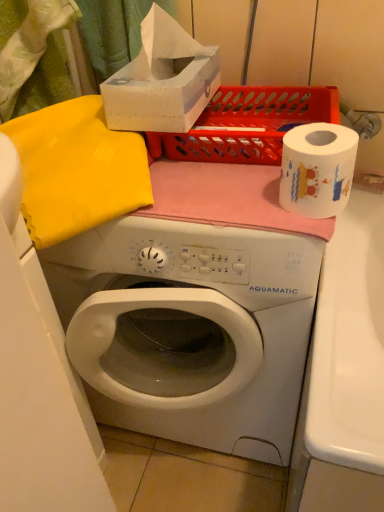
The height and width of the screenshot is (512, 384). Identify the location of empty space that is ontop of white plastic washing machine at center (from a real-world perspective). (197, 192).